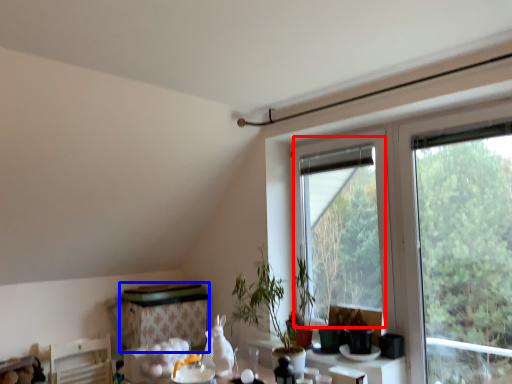
Question: Which of the following is the closest to the observer, bay window (highlighted by a red box) or table (highlighted by a blue box)?

Choices:
 (A) bay window
 (B) table

Answer: (A)